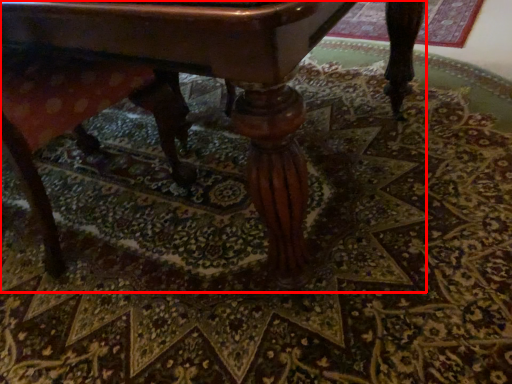
Question: Considering the relative positions of table (annotated by the red box) and swivel chair in the image provided, where is table (annotated by the red box) located with respect to the staircase?

Choices:
 (A) left
 (B) right

Answer: (B)